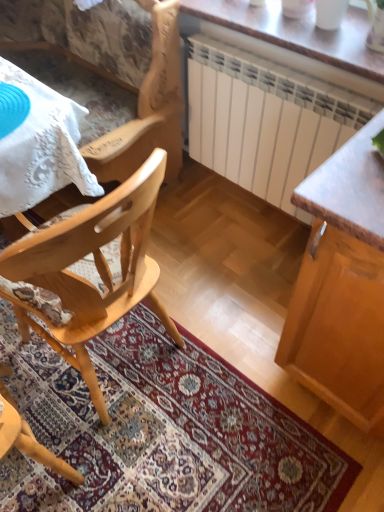
Question: Is wooden table at upper center at the left side of wooden cabinet at right?

Choices:
 (A) no
 (B) yes

Answer: (B)

Question: Is wooden table at upper center behind wooden cabinet at right?

Choices:
 (A) yes
 (B) no

Answer: (A)

Question: From the image's perspective, is wooden table at upper center above wooden cabinet at right?

Choices:
 (A) yes
 (B) no

Answer: (A)

Question: Can you confirm if wooden table at upper center is smaller than wooden cabinet at right?

Choices:
 (A) no
 (B) yes

Answer: (B)

Question: Is wooden table at upper center turned away from wooden cabinet at right?

Choices:
 (A) no
 (B) yes

Answer: (A)

Question: Is point (281, 38) positioned closer to the camera than point (334, 297)?

Choices:
 (A) farther
 (B) closer

Answer: (A)

Question: Choose the correct answer: Is wooden table at upper center inside wooden cabinet at right or outside it?

Choices:
 (A) inside
 (B) outside

Answer: (B)

Question: From the image's perspective, is wooden table at upper center positioned above or below wooden cabinet at right?

Choices:
 (A) below
 (B) above

Answer: (B)

Question: In the image, is wooden table at upper center positioned in front of or behind wooden cabinet at right?

Choices:
 (A) front
 (B) behind

Answer: (B)

Question: From the image's perspective, is white lace tablecloth at upper left positioned above or below wooden table at upper center?

Choices:
 (A) below
 (B) above

Answer: (A)

Question: Considering the positions of point (46, 147) and point (302, 44), is point (46, 147) closer or farther from the camera than point (302, 44)?

Choices:
 (A) closer
 (B) farther

Answer: (A)

Question: From a real-world perspective, is white lace tablecloth at upper left positioned above or below wooden table at upper center?

Choices:
 (A) above
 (B) below

Answer: (B)

Question: Relative to wooden table at upper center, is white lace tablecloth at upper left in front or behind?

Choices:
 (A) front
 (B) behind

Answer: (A)

Question: Visually, is natural wood chair at left, which is the 2th chair from top to bottom, positioned to the left or to the right of carpeted mat at center?

Choices:
 (A) right
 (B) left

Answer: (B)

Question: From their relative heights in the image, would you say natural wood chair at left, which is counted as the first chair, starting from the bottom, is taller or shorter than carpeted mat at center?

Choices:
 (A) short
 (B) tall

Answer: (B)